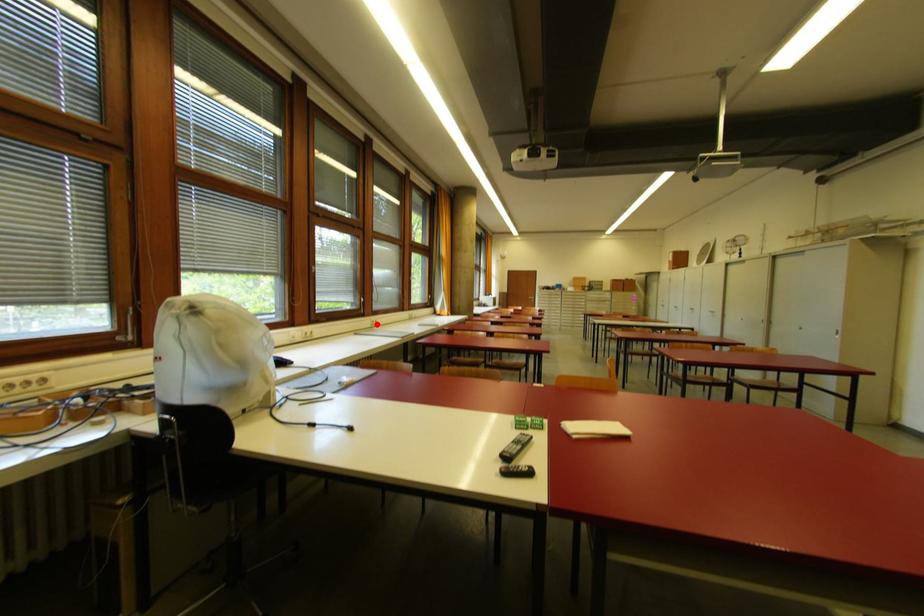
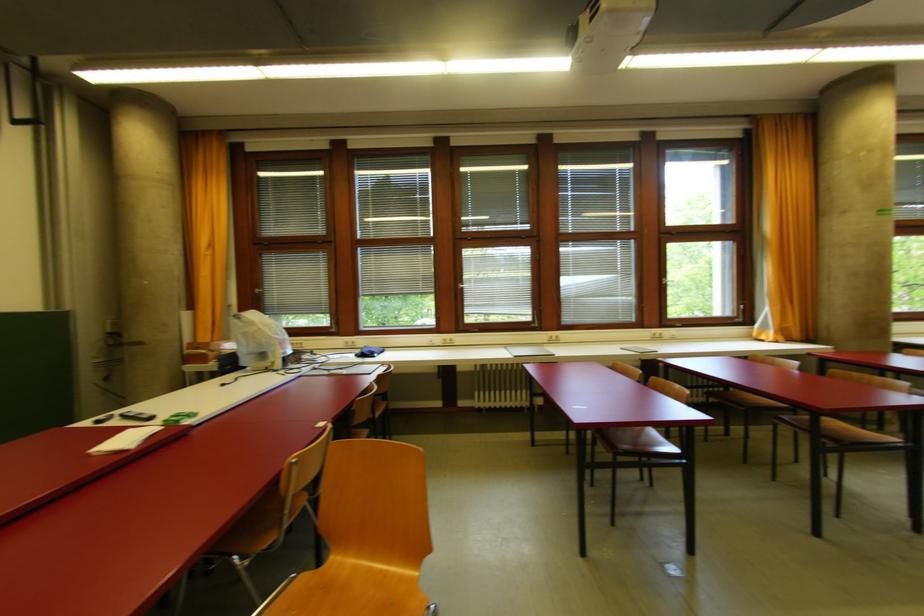
In the second image, find the point that corresponds to the highlighted location in the first image.

(556, 339)